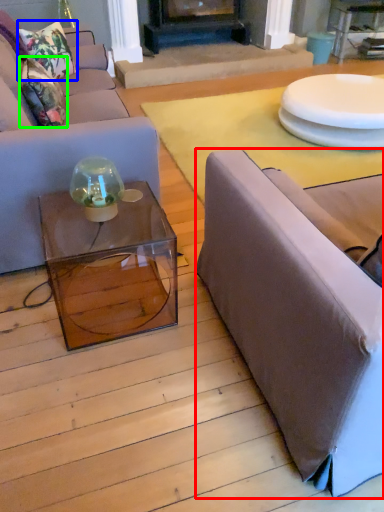
Question: Which is farther away from studio couch (highlighted by a red box)? pillow (highlighted by a blue box) or pillow (highlighted by a green box)?

Choices:
 (A) pillow
 (B) pillow

Answer: (A)